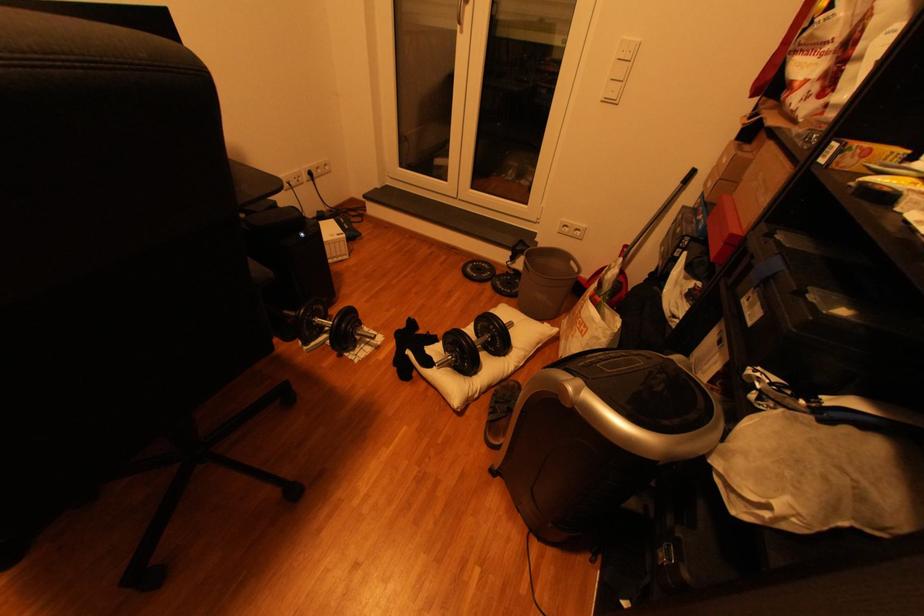
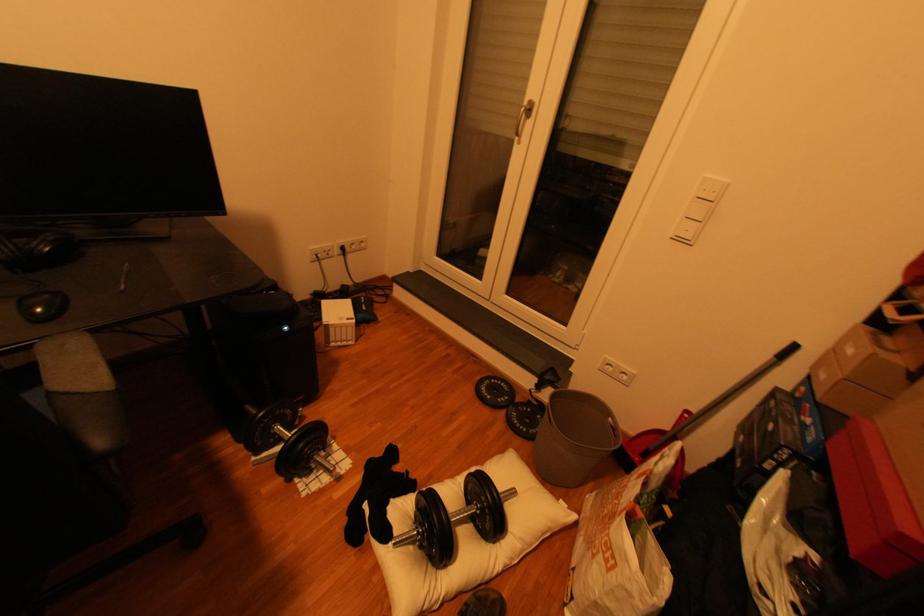
In the second image, find the point that corresponds to pixel 526 291 in the first image.

(543, 431)